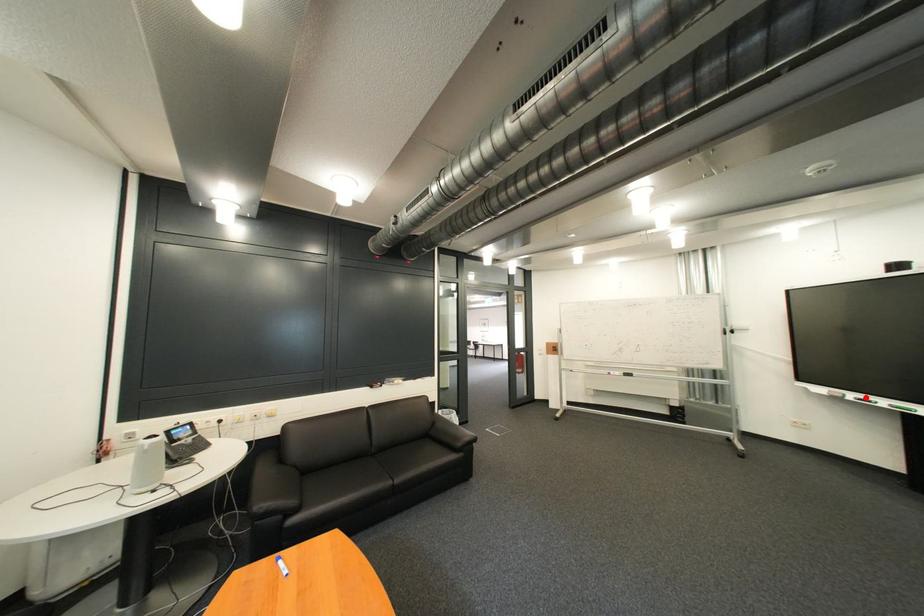
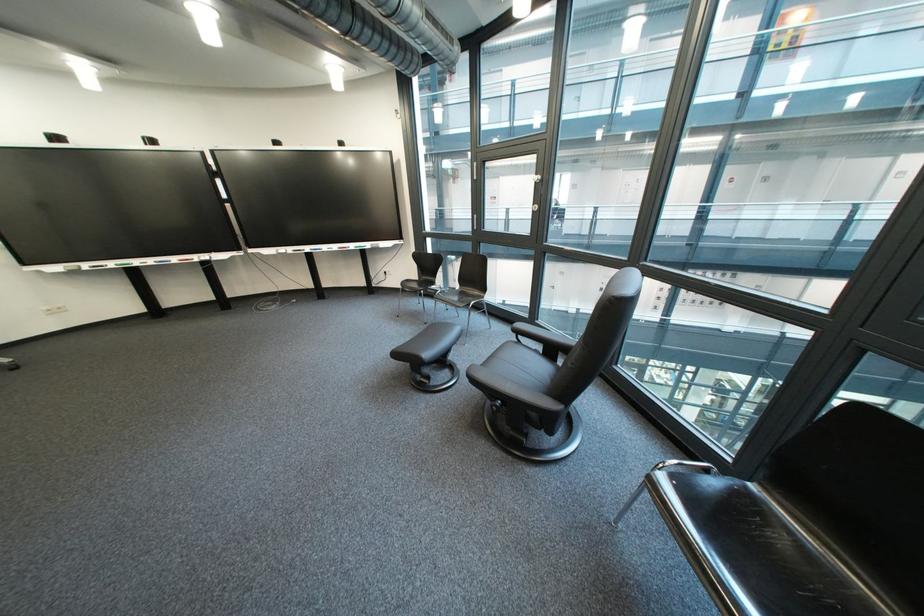
Where in the second image is the point corresponding to the highlighted location from the first image?

(100, 267)